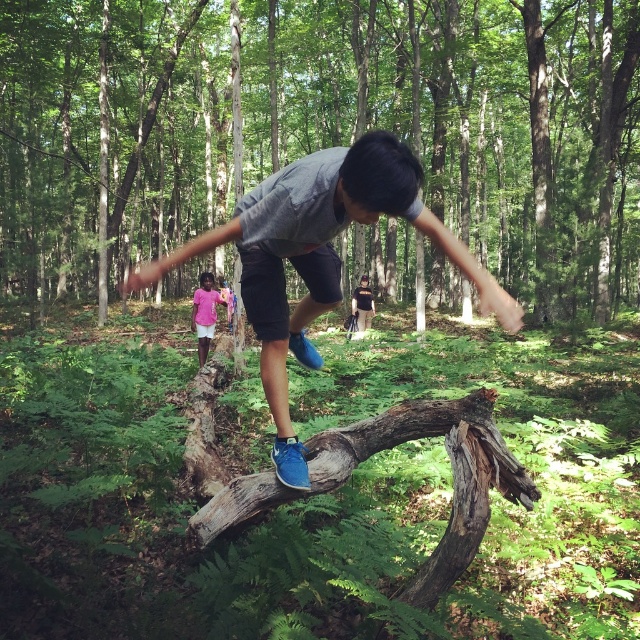
Does brown rough log at center have a smaller size compared to blue suede sneakers at center?

Incorrect, brown rough log at center is not smaller in size than blue suede sneakers at center.

Who is more distant from viewer, (58, 232) or (300, 204)?

The point (58, 232) is more distant.

At what (x,y) coordinates should I click in order to perform the action: click on brown rough log at center. Please return your answer as a coordinate pair (x, y). The image size is (640, 640). Looking at the image, I should click on (472, 124).

Is blue suede sneakers at center further to camera compared to pink fabric dress at center?

No, blue suede sneakers at center is closer to the viewer.

In the scene shown: Does blue suede sneakers at center have a smaller size compared to pink fabric dress at center?

Correct, blue suede sneakers at center occupies less space than pink fabric dress at center.

Describe the element at coordinates (320, 257) in the screenshot. The height and width of the screenshot is (640, 640). I see `blue suede sneakers at center` at that location.

Where is `blue suede sneakers at center`? This screenshot has height=640, width=640. blue suede sneakers at center is located at coordinates [320, 257].

Does blue suede sneakers at center come in front of dark brown leather backpack at center?

That is True.

Is blue suede sneakers at center to the right of dark brown leather backpack at center from the viewer's perspective?

Incorrect, blue suede sneakers at center is not on the right side of dark brown leather backpack at center.

Where is `blue suede sneakers at center`? This screenshot has height=640, width=640. blue suede sneakers at center is located at coordinates (320, 257).

Find the location of a particular element. blue suede sneakers at center is located at coordinates (320, 257).